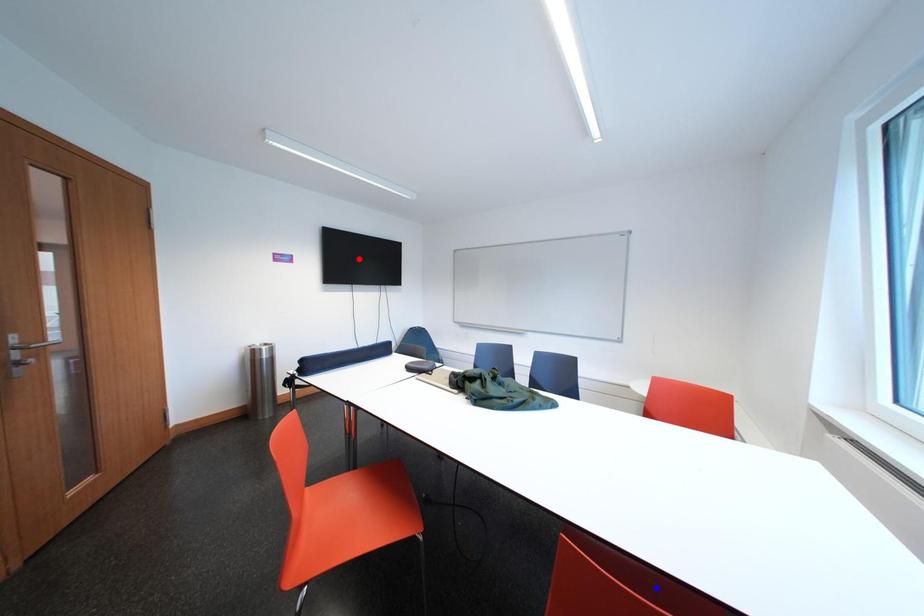
Question: In the image, two points are highlighted. Which point is nearer to the camera? Reply with the corresponding letter.

Choices:
 (A) blue point
 (B) red point

Answer: (A)